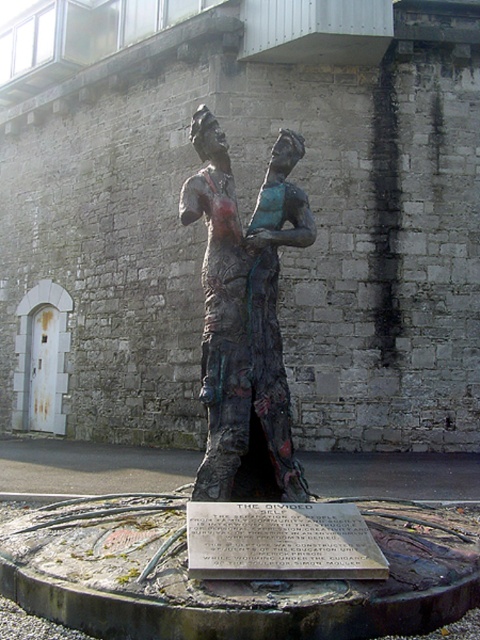
Is point (259, 205) positioned before point (245, 529)?

No, it is behind (245, 529).

Between bronze textured figures at center and bronze plaque at center, which one is positioned lower?

Positioned lower is bronze plaque at center.

Between point (211, 128) and point (334, 518), which one is positioned in front?

Point (334, 518) is in front.

Locate an element on the screen. This screenshot has width=480, height=640. bronze textured figures at center is located at coordinates (245, 321).